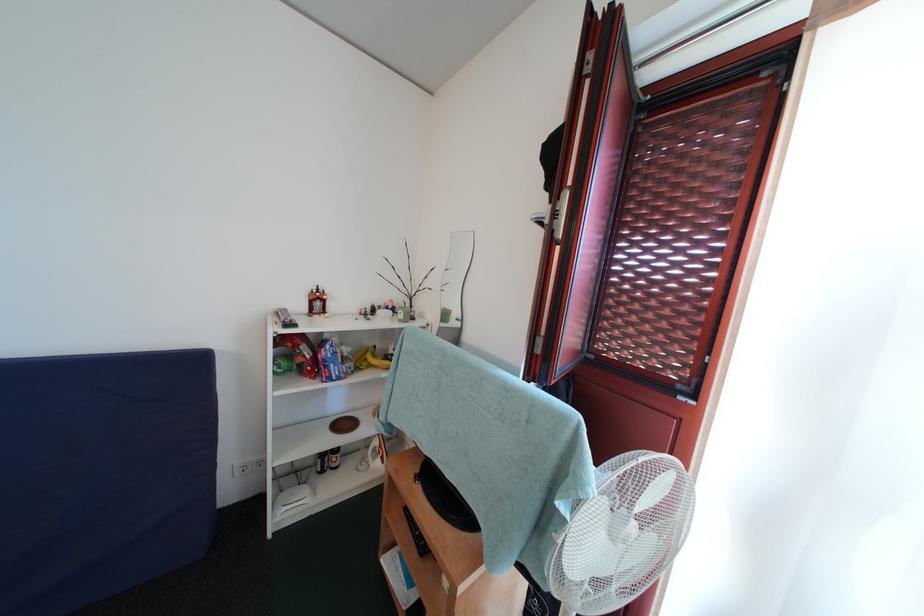
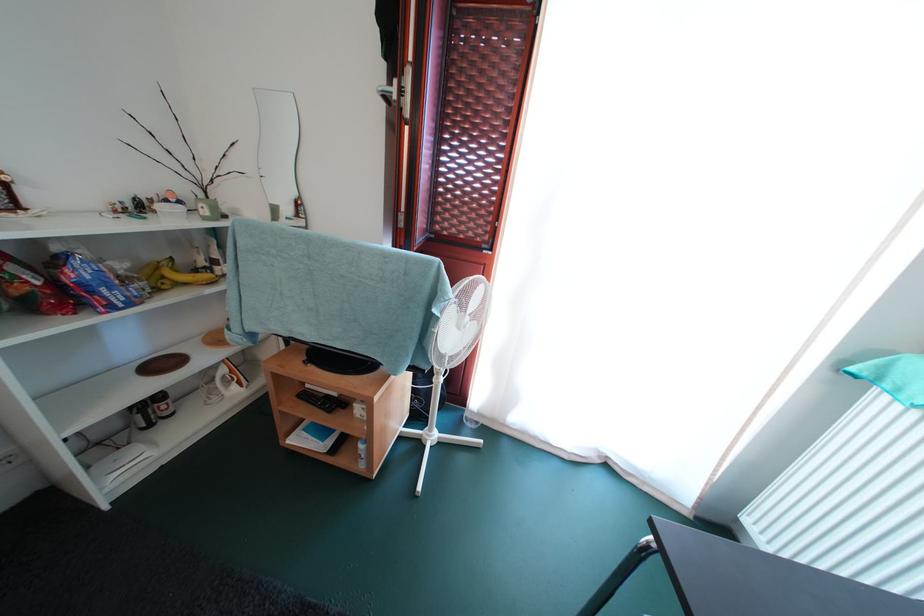
The point at [546,228] is marked in the first image. Where is the corresponding point in the second image?

(394, 103)